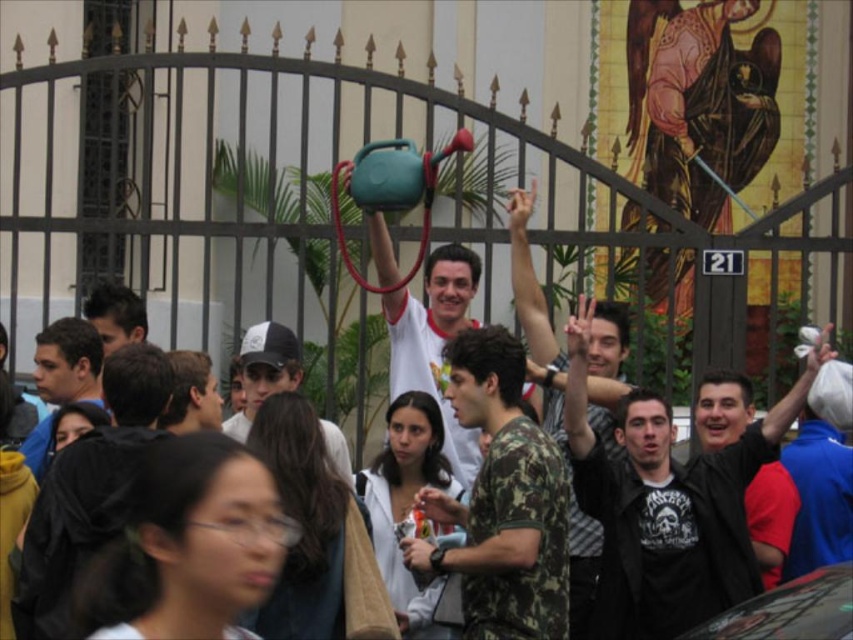
Who is shorter, camouflage-patterned shirt at center or dark brown hair at center?

Standing shorter between the two is dark brown hair at center.

Which of these two, camouflage-patterned shirt at center or dark brown hair at center, stands taller?

camouflage-patterned shirt at center is taller.

Between point (281, 390) and point (136, 298), which one is positioned behind?

Point (136, 298)

You are a GUI agent. You are given a task and a screenshot of the screen. Output one action in this format:
    pyautogui.click(x=<x>, y=<y>)
    Task: Click on the camouflage-patterned shirt at center
    
    Given the screenshot: What is the action you would take?
    pyautogui.click(x=264, y=371)

Consider the image. Between matte green water jug at center and matte black jacket at left, which one is positioned lower?

matte black jacket at left

Is the position of matte green water jug at center more distant than that of matte black jacket at left?

Yes, matte green water jug at center is further from the viewer.

Which is behind, point (445, 410) or point (45, 444)?

Positioned behind is point (445, 410).

Image resolution: width=853 pixels, height=640 pixels. I want to click on matte green water jug at center, so click(434, 342).

Does camouflage jacket at center have a greater height compared to dark brown hair at center?

Correct, camouflage jacket at center is much taller as dark brown hair at center.

Identify the location of camouflage jacket at center. (666, 506).

Identify the location of camouflage jacket at center. The image size is (853, 640). (666, 506).

The height and width of the screenshot is (640, 853). In order to click on camouflage jacket at center in this screenshot , I will do tap(666, 506).